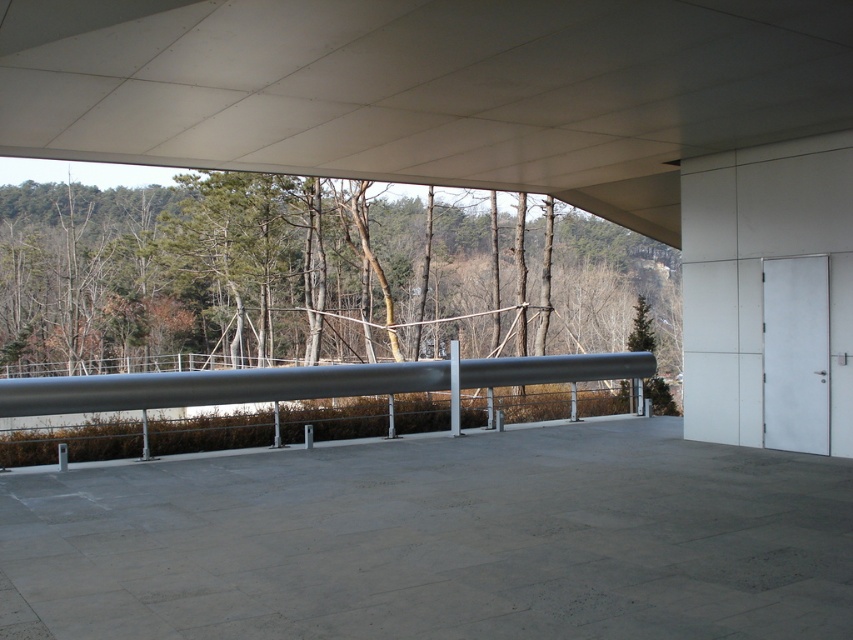
Question: Which of the following is the closest to the observer?

Choices:
 (A) metallic gray railing at upper center
 (B) gray concrete at center

Answer: (B)

Question: Is green matte tree at center to the right of silver metallic rail at center from the viewer's perspective?

Choices:
 (A) no
 (B) yes

Answer: (A)

Question: Which object appears closest to the camera in this image?

Choices:
 (A) metallic gray railing at upper center
 (B) silver metallic rail at center
 (C) green matte tree at center
 (D) gray concrete at center

Answer: (D)

Question: Is gray concrete at center to the left of green matte tree at center from the viewer's perspective?

Choices:
 (A) yes
 (B) no

Answer: (B)

Question: Does metallic gray railing at upper center appear on the right side of silver metallic rail at center?

Choices:
 (A) yes
 (B) no

Answer: (A)

Question: Which object is closer to the camera taking this photo?

Choices:
 (A) gray concrete at center
 (B) green matte tree at center
 (C) metallic gray railing at upper center
 (D) silver metallic rail at center

Answer: (A)